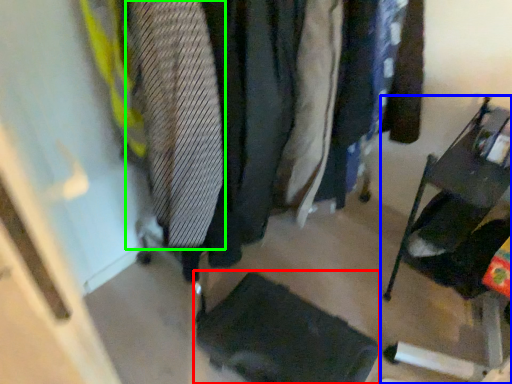
Question: Estimate the real-world distances between objects in this image. Which object is closer to footrest (highlighted by a red box), furniture (highlighted by a blue box) or tie (highlighted by a green box)?

Choices:
 (A) furniture
 (B) tie

Answer: (A)